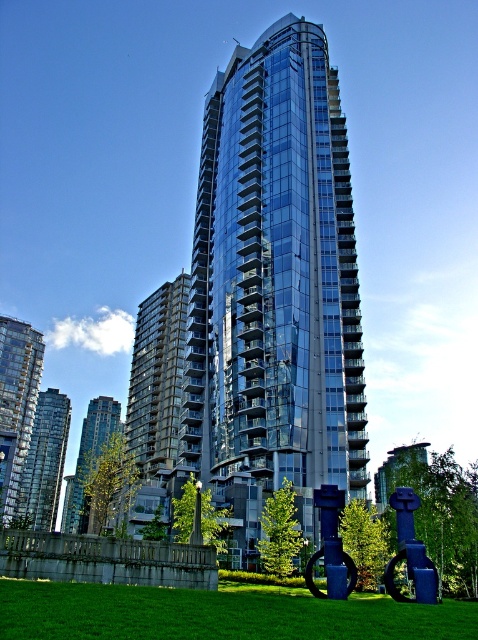
You are a city planner assessing the view from the transparent glass building at center. From the building, can you see the green grass at lower center?

The green grass at lower center is behind the transparent glass building at center, so from the building, you cannot see the green grass at lower center because it is located behind the building.

You are standing at a point in the urban landscape looking towards the glass skyscraper. There are two points marked in the image. Which point, point [307,22] or point [77,620], is closer to your current position?

Point [77,620] is closer to your current position because it is in front of point [307,22] according to their spatial arrangement.